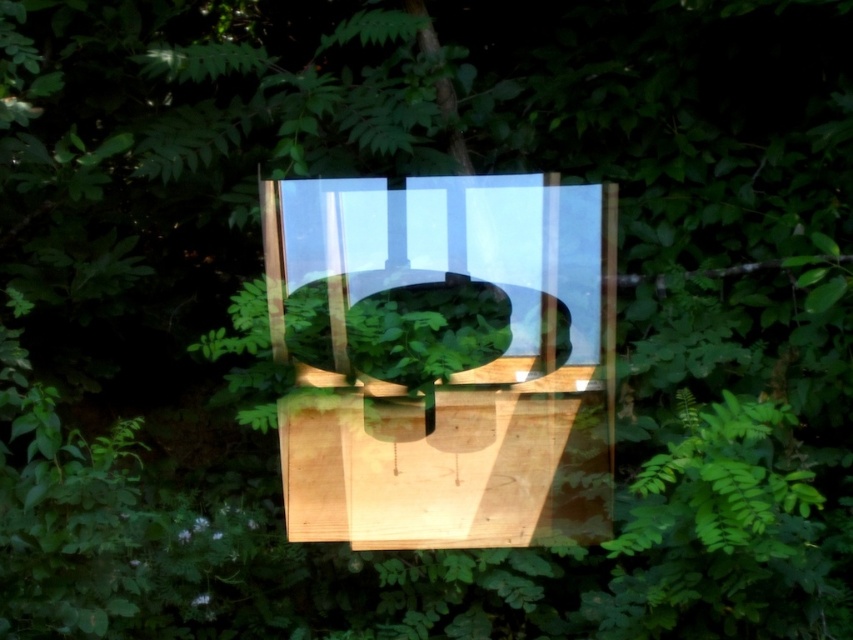
Between transparent glass plate at center and green matte bowl at center, which one is positioned lower?

green matte bowl at center is lower down.

Does point (448, 186) come farther from viewer compared to point (405, 320)?

Yes.

The image size is (853, 640). In order to click on transparent glass plate at center in this screenshot , I will do `click(451, 256)`.